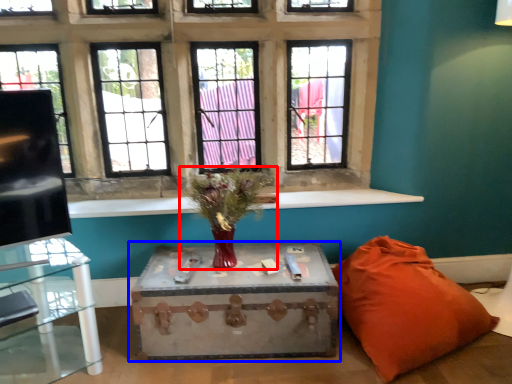
Question: Which object appears closest to the camera in this image, houseplant (highlighted by a red box) or table (highlighted by a blue box)?

Choices:
 (A) houseplant
 (B) table

Answer: (A)